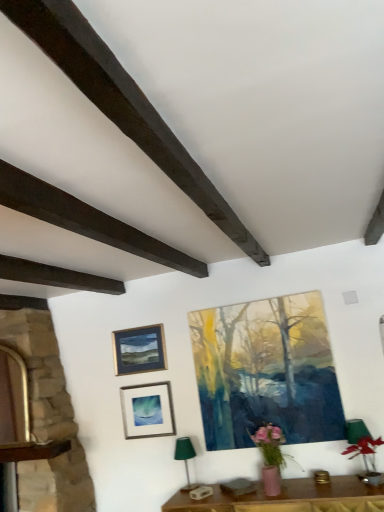
The width and height of the screenshot is (384, 512). What do you see at coordinates (123, 104) in the screenshot?
I see `dark brown wood at upper left, which is the first plank in right-to-left order` at bounding box center [123, 104].

How much space does dark brown wood at upper left, which is the first plank in left-to-right order, occupy vertically?

dark brown wood at upper left, which is the first plank in left-to-right order, is 5.56 inches in height.

The width and height of the screenshot is (384, 512). I want to click on pink matte vase at lower right, so click(x=271, y=480).

What do you see at coordinates (48, 418) in the screenshot?
I see `stone fireplace at left` at bounding box center [48, 418].

Measure the distance between stone fireplace at left and camera.

stone fireplace at left is 2.97 meters away from camera.

What is the approximate width of matte glass picture frame at lower center, which is counted as the 2th picture frame, starting from the right?

2.01 inches.

In order to face matte glass picture frame at lower center, placed as the 2th picture frame when sorted from left to right, should I rotate leftwards or rightwards?

Turn left approximately 6.035 degrees to face it.

The width and height of the screenshot is (384, 512). Describe the element at coordinates (185, 459) in the screenshot. I see `green fabric lampshade at lower center` at that location.

Image resolution: width=384 pixels, height=512 pixels. In order to click on dark brown wood at upper left, which is the first plank in right-to-left order in this screenshot , I will do `click(123, 104)`.

Does point (18, 325) come behind point (278, 469)?

Yes.

Between stone fireplace at left and pink matte vase at lower right, which one appears on the left side from the viewer's perspective?

Positioned to the left is stone fireplace at left.

Are stone fireplace at left and pink matte vase at lower right making contact?

stone fireplace at left and pink matte vase at lower right are not in contact.

Between stone fireplace at left and pink matte vase at lower right, which one has larger size?

With larger size is stone fireplace at left.

From a real-world perspective, which object rests below the other?

pink matte vase at lower right, from a real-world perspective.

What are the coordinates of `flowerpot directly beneath the dark brown wood at upper left, which is the first plank in left-to-right order (from a real-world perspective)` in the screenshot? It's located at [271, 480].

Is dark brown wood at upper left, which is the first plank in left-to-right order, further to the viewer compared to pink matte vase at lower right?

No, dark brown wood at upper left, which is the first plank in left-to-right order, is closer to the camera.

How different are the orientations of dark brown wood at upper left, which is the 2th plank in right-to-left order, and pink matte vase at lower right in degrees?

87.2 degrees separate the facing orientations of dark brown wood at upper left, which is the 2th plank in right-to-left order, and pink matte vase at lower right.

Is point (71, 465) closer to camera compared to point (99, 69)?

No, (71, 465) is further to viewer.

From the image's perspective, between stone fireplace at left and dark brown wood at upper left, which is counted as the second plank, starting from the left, which one is located above?

From the image's view, dark brown wood at upper left, which is counted as the second plank, starting from the left, is above.

What's the angular difference between stone fireplace at left and dark brown wood at upper left, which is counted as the second plank, starting from the left,'s facing directions?

The angle between the facing direction of stone fireplace at left and the facing direction of dark brown wood at upper left, which is counted as the second plank, starting from the left, is 90.3 degrees.

Which object is positioned more to the left, stone fireplace at left or dark brown wood at upper left, which is counted as the second plank, starting from the left?

Positioned to the left is stone fireplace at left.

Does dark brown wood at upper left, which is the 2th plank in right-to-left order, lie behind stone fireplace at left?

No, it is in front of stone fireplace at left.

In the image, there is a dark brown wood at upper left, which is the 2th plank in right-to-left order. Identify the location of fireplace below it (from a real-world perspective). The height and width of the screenshot is (512, 384). (48, 418).

Consider the image. Which of these two, dark brown wood at upper left, which is the 2th plank in right-to-left order, or stone fireplace at left, is wider?

With larger width is stone fireplace at left.

How different are the orientations of dark brown wood at upper left, which is the 2th plank in right-to-left order, and stone fireplace at left in degrees?

There is a 90.3-degree angle between the facing directions of dark brown wood at upper left, which is the 2th plank in right-to-left order, and stone fireplace at left.

In terms of size, does dark brown wood at upper left, which is the first plank in right-to-left order, appear bigger or smaller than green fabric lampshade at lower center?

dark brown wood at upper left, which is the first plank in right-to-left order, is bigger than green fabric lampshade at lower center.

In the image, is dark brown wood at upper left, which is the first plank in right-to-left order, positioned in front of or behind green fabric lampshade at lower center?

Visually, dark brown wood at upper left, which is the first plank in right-to-left order, is located in front of green fabric lampshade at lower center.

The width and height of the screenshot is (384, 512). In order to click on lamp located underneath the dark brown wood at upper left, which is counted as the second plank, starting from the left (from a real-world perspective) in this screenshot , I will do `click(185, 459)`.

Considering the positions of point (130, 346) and point (43, 501), is point (130, 346) closer or farther from the camera than point (43, 501)?

Point (130, 346) is positioned farther from the camera compared to point (43, 501).

Would you say stone fireplace at left is part of gold-framed picture at upper left, arranged as the third picture frame when viewed from the right,'s contents?

That's incorrect, stone fireplace at left is not inside gold-framed picture at upper left, arranged as the third picture frame when viewed from the right.

In the scene shown: Could you measure the distance between gold-framed picture at upper left, arranged as the third picture frame when viewed from the right, and stone fireplace at left?

gold-framed picture at upper left, arranged as the third picture frame when viewed from the right, is 71.62 centimeters away from stone fireplace at left.

Which object is further away from the camera taking this photo, gold-framed picture at upper left, arranged as the third picture frame when viewed from the right, or stone fireplace at left?

Positioned behind is gold-framed picture at upper left, arranged as the third picture frame when viewed from the right.

From a real-world perspective, is matte glass picture frame at lower center, which is counted as the 2th picture frame, starting from the right, physically located above or below dark brown wood at upper left, which is counted as the second plank, starting from the left?

In terms of real-world spatial position, matte glass picture frame at lower center, which is counted as the 2th picture frame, starting from the right, is below dark brown wood at upper left, which is counted as the second plank, starting from the left.

Does matte glass picture frame at lower center, which is counted as the 2th picture frame, starting from the right, have a lesser width compared to dark brown wood at upper left, which is the first plank in right-to-left order?

Yes, matte glass picture frame at lower center, which is counted as the 2th picture frame, starting from the right, is thinner than dark brown wood at upper left, which is the first plank in right-to-left order.

Considering the relative positions of matte glass picture frame at lower center, which is counted as the 2th picture frame, starting from the right, and dark brown wood at upper left, which is the first plank in right-to-left order, in the image provided, is matte glass picture frame at lower center, which is counted as the 2th picture frame, starting from the right, behind dark brown wood at upper left, which is the first plank in right-to-left order,?

Yes, it is.

You are a GUI agent. You are given a task and a screenshot of the screen. Output one action in this format:
    pyautogui.click(x=<x>, y=<y>)
    Task: Click on the 2nd plank to the right of the matte glass picture frame at lower center, which is counted as the 2th picture frame, starting from the right, counting from the anchor's position
    The width and height of the screenshot is (384, 512).
    Given the screenshot: What is the action you would take?
    pyautogui.click(x=123, y=104)

Identify the location of fireplace lying above the pink matte vase at lower right (from the image's perspective). The height and width of the screenshot is (512, 384). (48, 418).

Find the location of a particular element. Image resolution: width=384 pixels, height=512 pixels. flowerpot to the right of dark brown wood at upper left, which is the 2th plank in right-to-left order is located at coordinates (271, 480).

Looking at the image, which one is located further to matte glass picture frame at lower center, placed as the 2th picture frame when sorted from left to right, green fabric lampshade at lower center or gold-framed picture at upper left, arranged as the third picture frame when viewed from the right?

The object further to matte glass picture frame at lower center, placed as the 2th picture frame when sorted from left to right, is green fabric lampshade at lower center.

From the image, which object appears to be farther from dark brown wood at upper left, which is the first plank in left-to-right order, matte acrylic painting at center, the third picture frame in the left-to-right sequence, or stone fireplace at left?

Based on the image, stone fireplace at left appears to be further to dark brown wood at upper left, which is the first plank in left-to-right order.

Looking at the image, which one is located further to matte glass picture frame at lower center, placed as the 2th picture frame when sorted from left to right, dark brown wood at upper left, which is the first plank in left-to-right order, or green fabric lampshade at lower center?

Based on the image, dark brown wood at upper left, which is the first plank in left-to-right order, appears to be further to matte glass picture frame at lower center, placed as the 2th picture frame when sorted from left to right.

When comparing their distances from gold-framed picture at upper left, arranged as the third picture frame when viewed from the right, does green fabric lampshade at lower center or stone fireplace at left seem closer?

stone fireplace at left lies closer to gold-framed picture at upper left, arranged as the third picture frame when viewed from the right, than the other object.

From the image, which object appears to be nearer to gold-framed picture at upper left, arranged as the third picture frame when viewed from the right, green fabric lampshade at lower center or matte acrylic painting at center, the third picture frame in the left-to-right sequence?

green fabric lampshade at lower center is closer to gold-framed picture at upper left, arranged as the third picture frame when viewed from the right.

Which object lies nearer to the anchor point dark brown wood at upper left, which is the first plank in right-to-left order, matte acrylic painting at center, the first picture frame from the right, or matte glass picture frame at lower center, placed as the 2th picture frame when sorted from left to right?

matte acrylic painting at center, the first picture frame from the right, lies closer to dark brown wood at upper left, which is the first plank in right-to-left order, than the other object.

Which object lies further to the anchor point matte glass picture frame at lower center, placed as the 2th picture frame when sorted from left to right, dark brown wood at upper left, which is counted as the second plank, starting from the left, or gold-framed picture at upper left, arranged as the third picture frame when viewed from the right?

Among the two, dark brown wood at upper left, which is counted as the second plank, starting from the left, is located further to matte glass picture frame at lower center, placed as the 2th picture frame when sorted from left to right.

Based on their spatial positions, is green fabric lampshade at lower center or pink matte vase at lower right further from matte glass picture frame at lower center, which is counted as the 2th picture frame, starting from the right?

Based on the image, pink matte vase at lower right appears to be further to matte glass picture frame at lower center, which is counted as the 2th picture frame, starting from the right.

The height and width of the screenshot is (512, 384). I want to click on picture frame situated between gold-framed picture at upper left, the 1th picture frame viewed from the left, and matte acrylic painting at center, the first picture frame from the right, from left to right, so click(x=147, y=410).

I want to click on flowerpot between gold-framed picture at upper left, arranged as the third picture frame when viewed from the right, and matte acrylic painting at center, the first picture frame from the right, in the horizontal direction, so click(271, 480).

What are the coordinates of `fireplace between dark brown wood at upper left, which is the first plank in left-to-right order, and green fabric lampshade at lower center, along the z-axis` in the screenshot? It's located at (48, 418).

Where is `plank positioned between dark brown wood at upper left, which is the first plank in right-to-left order, and matte glass picture frame at lower center, placed as the 2th picture frame when sorted from left to right, from near to far`? plank positioned between dark brown wood at upper left, which is the first plank in right-to-left order, and matte glass picture frame at lower center, placed as the 2th picture frame when sorted from left to right, from near to far is located at coordinates (86, 220).